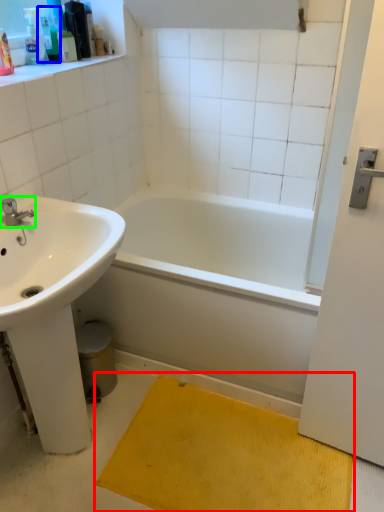
Question: Which object is the closest to the doormat (highlighted by a red box)? Choose among these: toiletry (highlighted by a blue box) or tap (highlighted by a green box).

Choices:
 (A) toiletry
 (B) tap

Answer: (B)